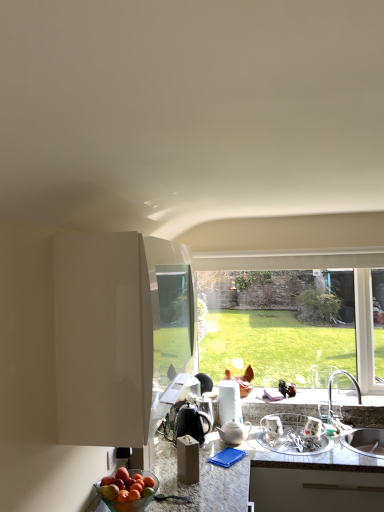
Question: From the image's perspective, is white glossy cabinet at left positioned above or below metallic silver dish rack at lower right, the 1th appliance viewed from the right?

Choices:
 (A) above
 (B) below

Answer: (A)

Question: Considering the positions of point (69, 418) and point (309, 441), is point (69, 418) closer or farther from the camera than point (309, 441)?

Choices:
 (A) farther
 (B) closer

Answer: (B)

Question: Which of these objects is positioned farthest from the granite countertop at center?

Choices:
 (A) metallic silver kettle at center, the second appliance from the right
 (B) metallic silver dish rack at lower right, marked as the third appliance in a left-to-right arrangement
 (C) shiny red apple at lower left
 (D) silver metallic sink at lower right
 (E) shiny metallic kettle at center, acting as the first appliance starting from the left

Answer: (A)

Question: Which object is positioned farthest from the clear glass window at center?

Choices:
 (A) shiny red apple at lower left
 (B) silver metallic sink at lower right
 (C) shiny metallic kettle at center, acting as the first appliance starting from the left
 (D) white glossy cabinet at left
 (E) metallic silver kettle at center, acting as the 2th appliance starting from the left

Answer: (A)